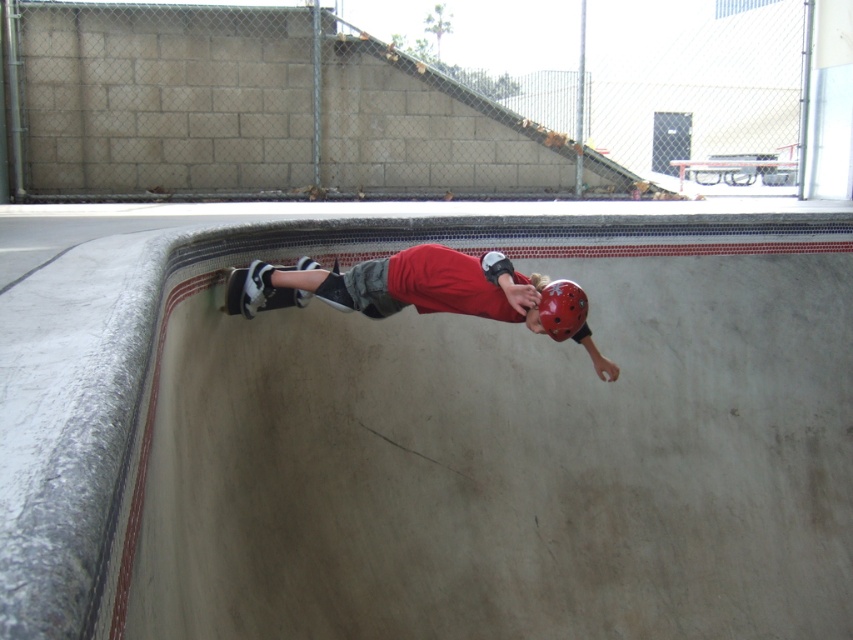
Consider the image. You are a photographer at the skatepark and want to capture the matte red helmet at center and the white rubber skateboard at lower left in the same frame. Based on their positions, which object should you focus on first to ensure both are in focus?

The matte red helmet at center is below the white rubber skateboard at lower left, so you should focus on the white rubber skateboard at lower left first to ensure both are in focus.

You are a photographer at the skatepark and want to take a photo of the red matte helmet at center and the smooth concrete skate park at center. If you are standing to the left of both objects, which object will appear closer to the left side of your photo?

The red matte helmet at center will appear closer to the left side of the photo because the smooth concrete skate park at center is positioned to its right side.